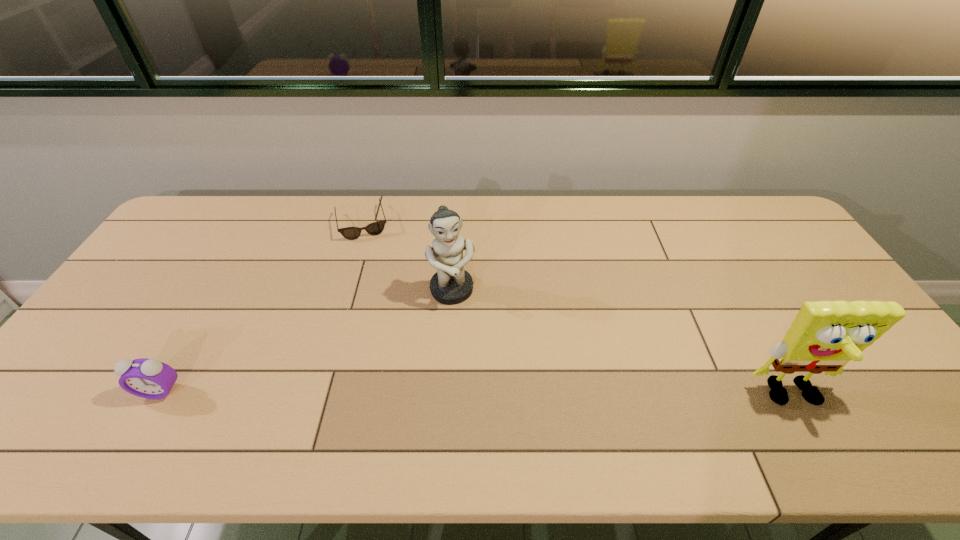
The image size is (960, 540). I want to click on vacant space positioned on the front lenses of the shortest object, so click(377, 294).

Where is `vacant area situated 0.240m on the front lenses of the shortest object`? This screenshot has height=540, width=960. vacant area situated 0.240m on the front lenses of the shortest object is located at coordinates (376, 291).

Find the location of a particular element. The height and width of the screenshot is (540, 960). vacant space located 0.050m on the front lenses of the shortest object is located at coordinates (368, 251).

Identify the location of object present at the far edge. (351, 233).

At what (x,y) coordinates should I click in order to perform the action: click on alarm clock located in the near edge section of the desktop. Please return your answer as a coordinate pair (x, y). This screenshot has width=960, height=540. Looking at the image, I should click on (147, 378).

Find the location of a particular element. The image size is (960, 540). sponge that is at the near edge is located at coordinates (825, 335).

Where is `vacant area at the far edge`? vacant area at the far edge is located at coordinates (592, 198).

This screenshot has height=540, width=960. What are the coordinates of `vacant space at the near edge` in the screenshot? It's located at tap(425, 392).

The width and height of the screenshot is (960, 540). In the image, there is a desktop. Find the location of `vacant region at the right edge`. vacant region at the right edge is located at coordinates (780, 258).

The height and width of the screenshot is (540, 960). In order to click on free spot between the sponge and the second farthest object in this screenshot , I will do `click(622, 344)`.